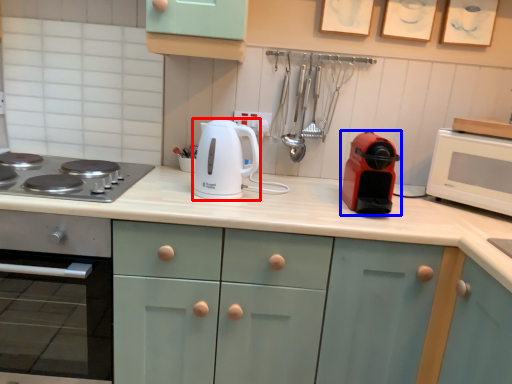
Question: Which object appears farthest to the camera in this image, kitchen appliance (highlighted by a red box) or kitchen appliance (highlighted by a blue box)?

Choices:
 (A) kitchen appliance
 (B) kitchen appliance

Answer: (A)